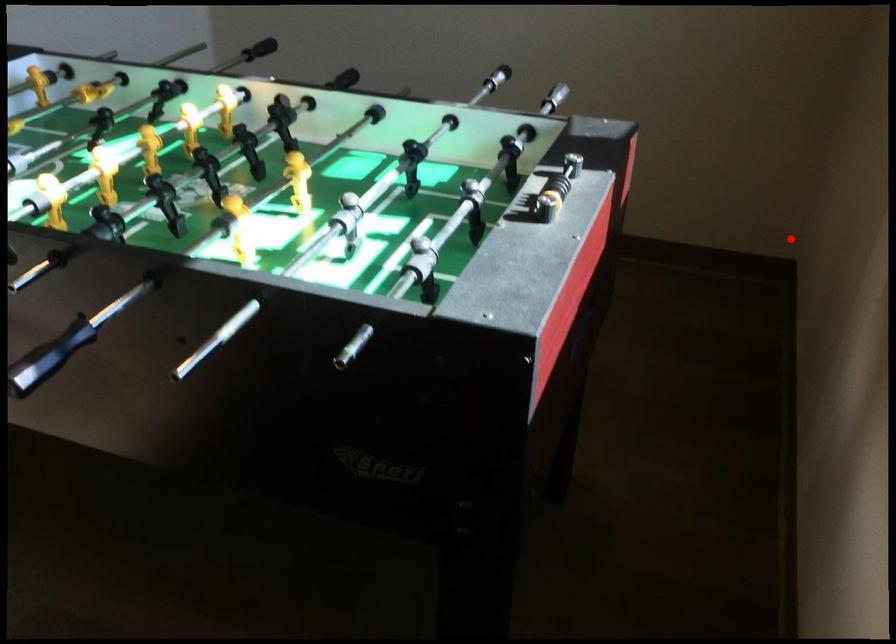
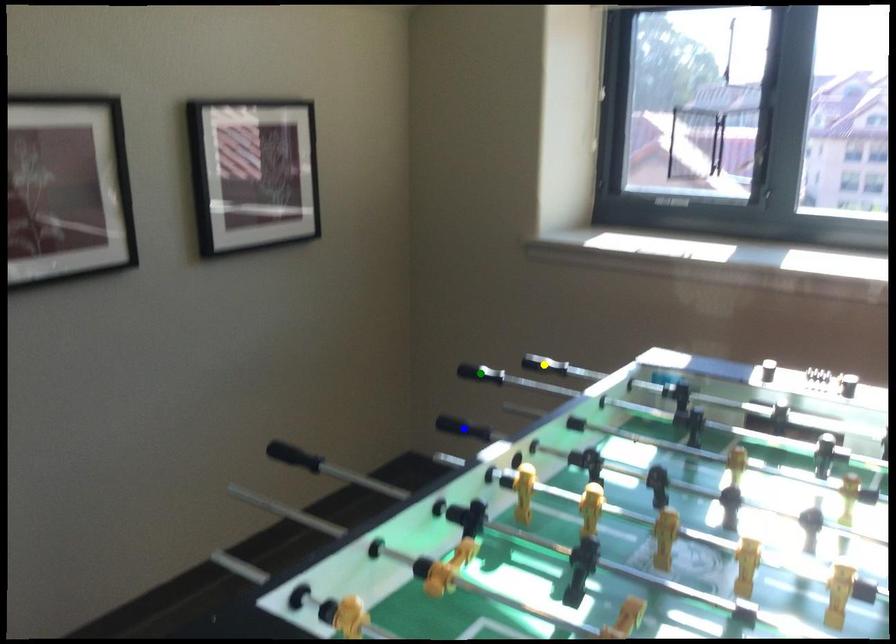
Question: I am providing you with two images of the same scene from different viewpoints. A red point is marked on the first image. You are given multiple points on the second image. Can you choose the point in image 2 that corresponds to the point in image 1?

Choices:
 (A) blue point
 (B) yellow point
 (C) green point

Answer: (A)